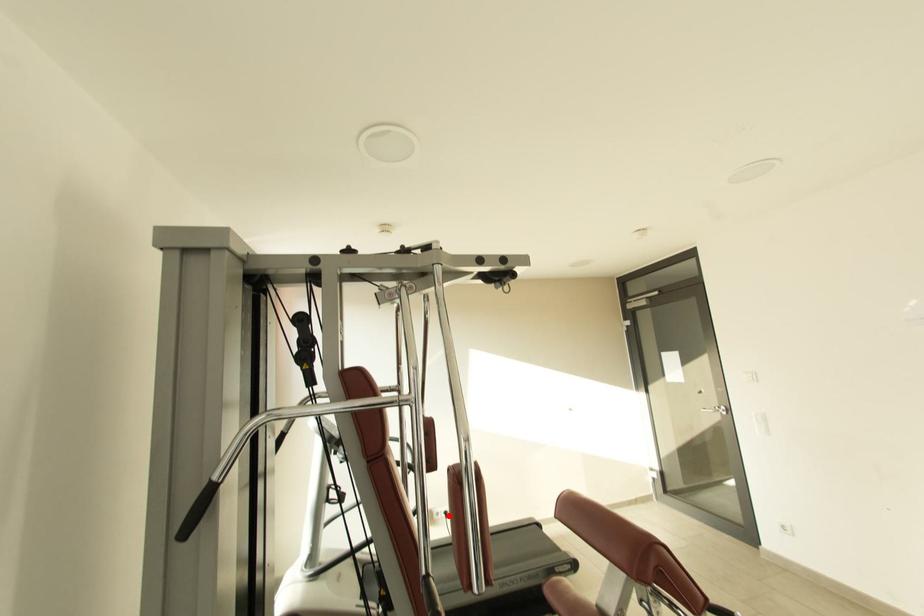
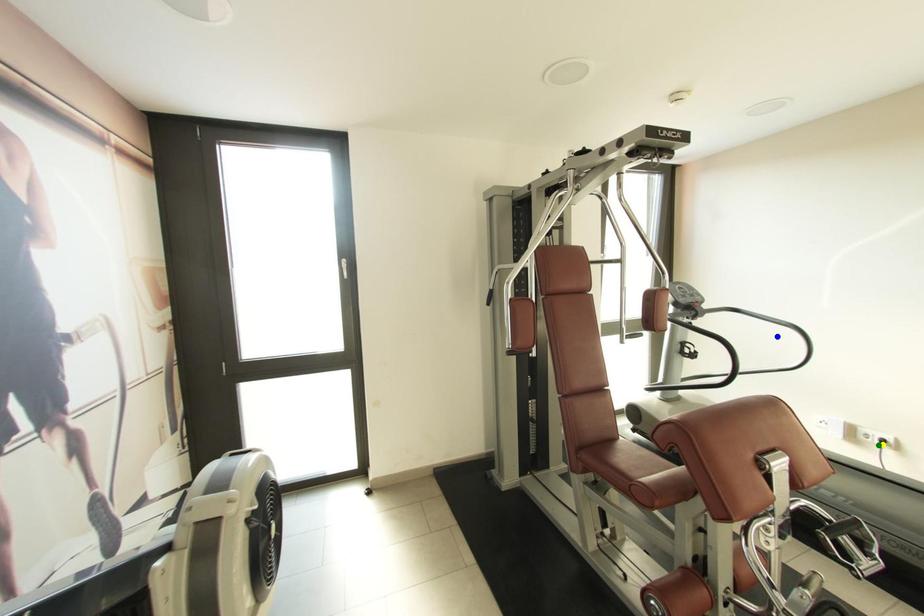
Question: I am providing you with two images of the same scene from different viewpoints. A red point is marked on the first image. You are given multiple points on the second image. In image 2, which mark is for the same physical point as the one in image 1?

Choices:
 (A) yellow point
 (B) blue point
 (C) green point

Answer: (A)